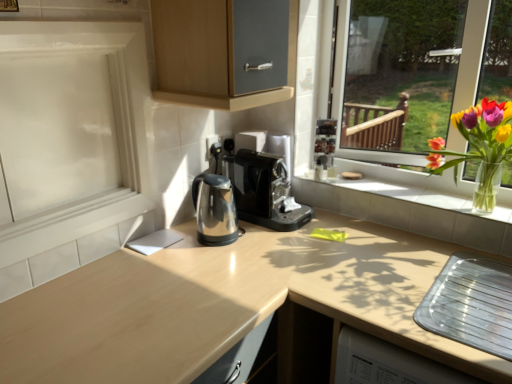
Question: Would you say white tile window sill at center is to the left or to the right of black plastic coffee machine at center in the picture?

Choices:
 (A) left
 (B) right

Answer: (B)

Question: From the image's perspective, is white tile window sill at center located above or below black plastic coffee machine at center?

Choices:
 (A) below
 (B) above

Answer: (A)

Question: Which object is positioned closest to the black plastic coffee machine at center?

Choices:
 (A) polished metallic kettle at center
 (B) white glossy screen door at left
 (C) translucent glass vase at right
 (D) white tile window sill at center

Answer: (A)

Question: Which is nearer to the polished metallic kettle at center?

Choices:
 (A) white tile window sill at center
 (B) translucent glass vase at right
 (C) black plastic coffee machine at center
 (D) white glossy screen door at left

Answer: (C)